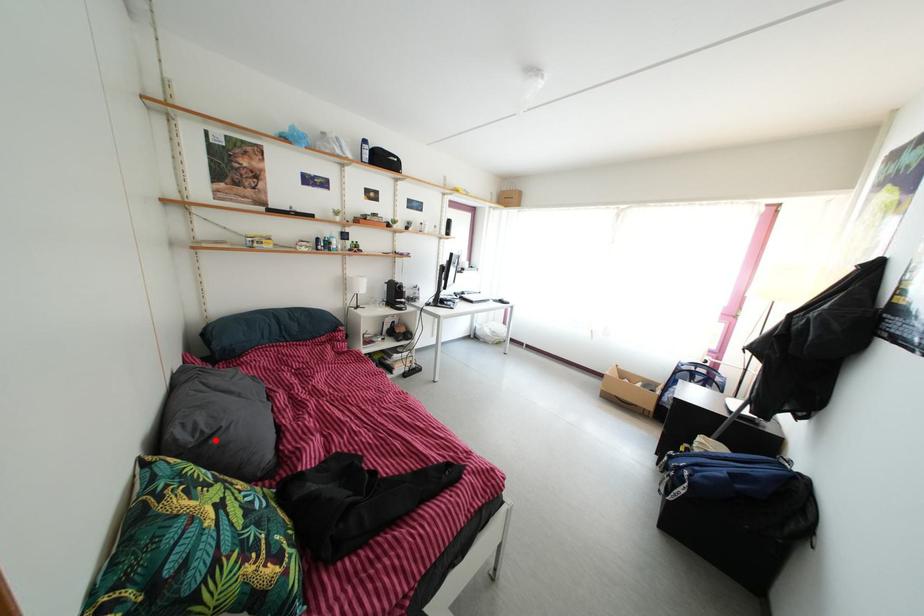
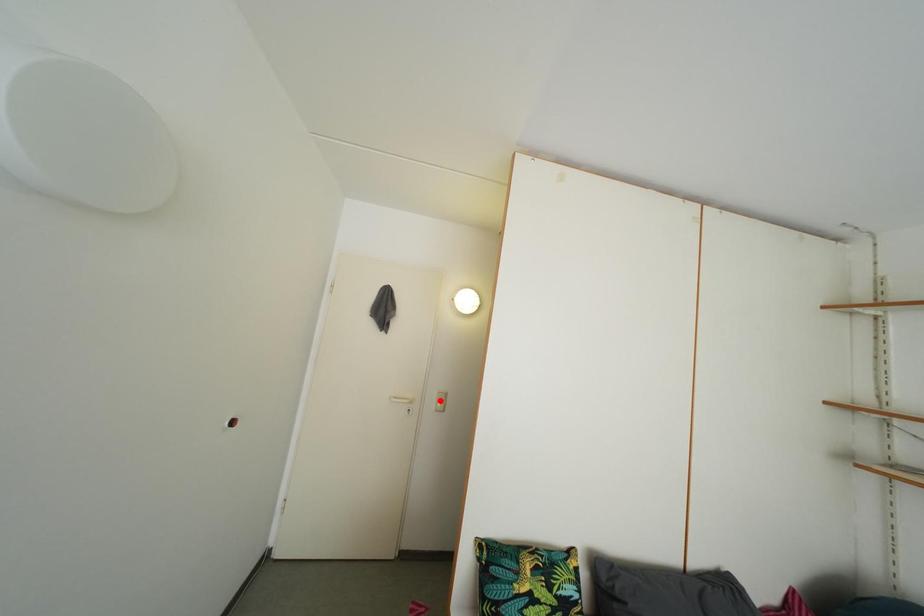
I am providing you with two images of the same scene from different viewpoints. A red point is marked on the first image and another point is marked on the second image. Is the marked point in image1 the same physical position as the marked point in image2?

No